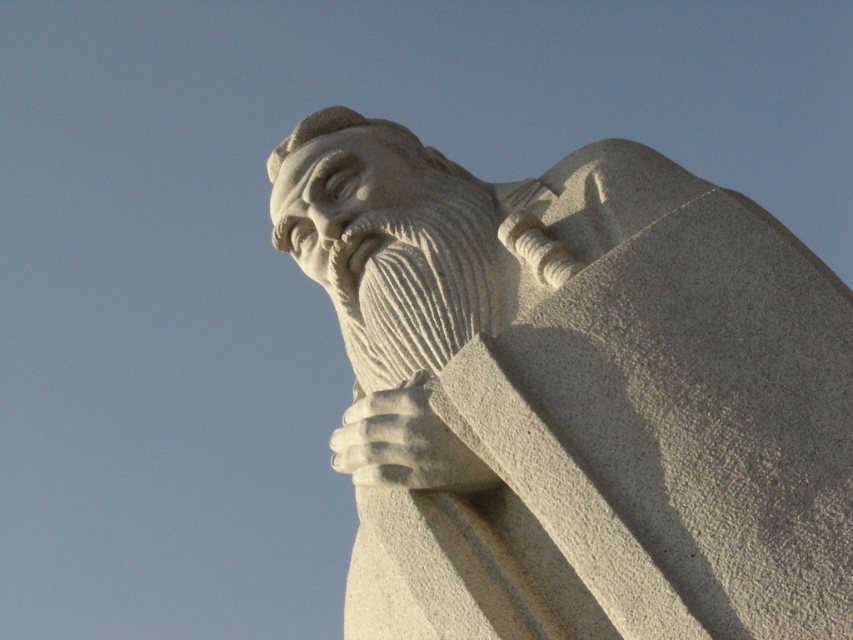
You are an art student observing the white stone statue at center and the white stone hand at center. Which object is positioned closer to you?

The white stone statue at center is closer to the viewer than the white stone hand at center.